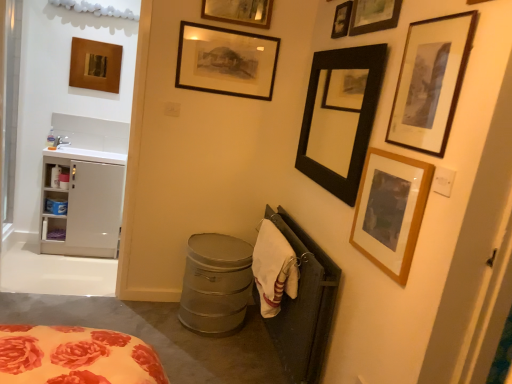
Question: Based on their sizes in the image, would you say white cotton towel at lower right is bigger or smaller than wooden framed print at upper right, the 8th picture frame positioned from the left?

Choices:
 (A) small
 (B) big

Answer: (B)

Question: From a real-world perspective, relative to wooden framed print at upper right, the 1th picture frame when ordered from right to left, is white cotton towel at lower right vertically above or below?

Choices:
 (A) below
 (B) above

Answer: (A)

Question: Estimate the real-world distances between objects in this image. Which object is farther from the white cotton towel at lower right?

Choices:
 (A) wooden picture frame at upper right, arranged as the second picture frame when viewed from the right
 (B) metallic gray trash can at lower center
 (C) white glossy sink at left
 (D) wooden framed picture at upper center, which ranks as the 3th picture frame in left-to-right order
 (E) wooden picture frame at upper left, the 1th picture frame from the left

Answer: (E)

Question: Considering the real-world distances, which object is closest to the white glossy sink at left?

Choices:
 (A) white matte cabinet at left
 (B) white plastic cabinet at left
 (C) wooden framed picture at upper center, which ranks as the 3th picture frame in left-to-right order
 (D) wooden picture frame at upper right, arranged as the second picture frame when viewed from the right
 (E) wooden framed print at upper right, the 8th picture frame positioned from the left

Answer: (A)